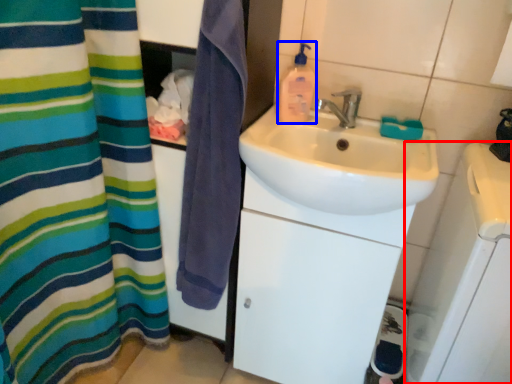
Question: Which object appears farthest to the camera in this image, appliance (highlighted by a red box) or cleaning product (highlighted by a blue box)?

Choices:
 (A) appliance
 (B) cleaning product

Answer: (B)